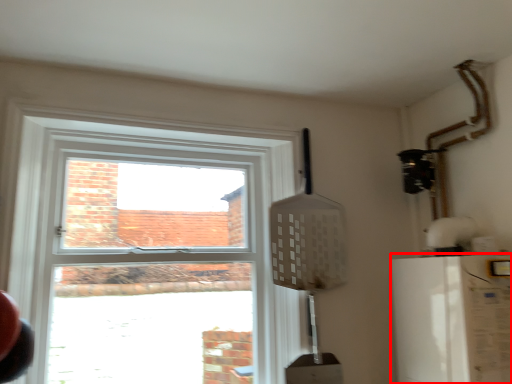
Question: From the image's perspective, where is appliance (annotated by the red box) located relative to window?

Choices:
 (A) above
 (B) below

Answer: (B)